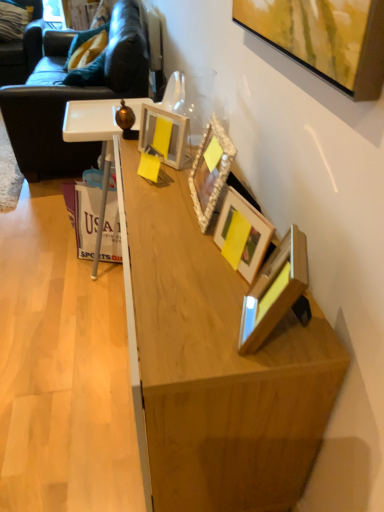
I want to click on free space in front of wooden picture frame at center, which is the 2th picture frame in front-to-back order, so click(237, 307).